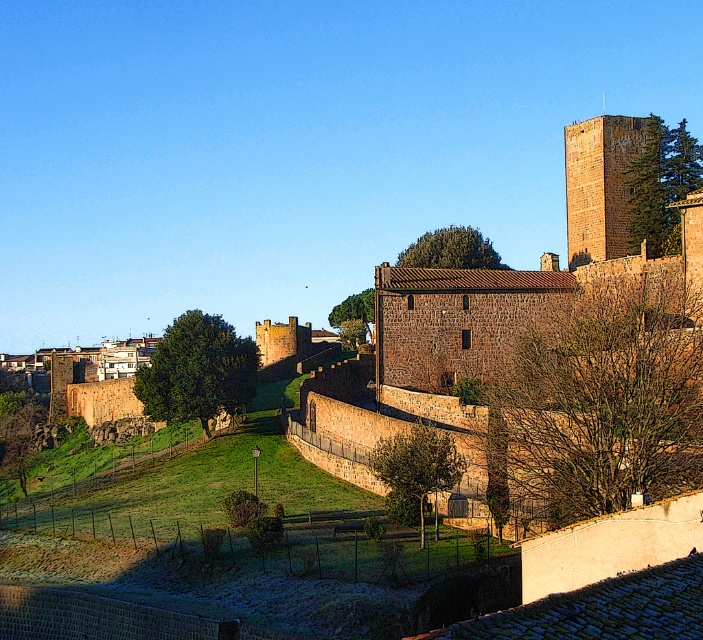
You are an architect visiting the historic site. You notice the brown stone castle at center and the brown stone tower at upper right. Which structure is closer to your current position?

The brown stone castle at center is closer to your current position because it is in front of the brown stone tower at upper right, indicating it is nearer to the viewer.

You are standing at the entrance of the historic stone structure. You want to take a photo of the brown stone castle at center. Where should you position yourself to ensure the castle is centered in your camera viewfinder?

The brown stone castle at center is located at coordinates point (543, 353), so you should position yourself directly in front of it to ensure it is centered in your camera viewfinder.

You are a tourist visiting the historic site and want to take a photo that includes both the brown stone castle at center and the brown stone tower at upper right. Which object should you position closer to the camera to ensure both are fully visible in the frame?

You should position the brown stone tower at upper right closer to the camera because the brown stone castle at center is much taller, so placing the shorter tower nearer will help balance their sizes in the photo.